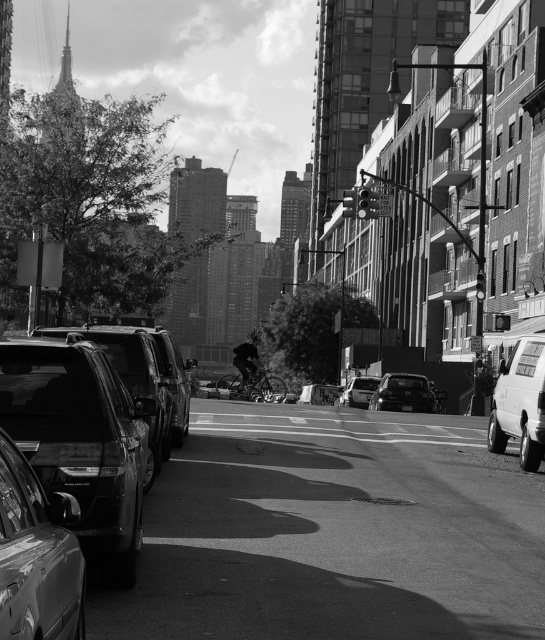
In the scene shown: How far apart are shiny black suv at left and shiny black sedan at center?

A distance of 85.89 feet exists between shiny black suv at left and shiny black sedan at center.

The height and width of the screenshot is (640, 545). What are the coordinates of `shiny black suv at left` in the screenshot? It's located at (83, 440).

Is shiny black suv at left bigger than white matte van at right?

Yes.

Does shiny black suv at left appear on the right side of white matte van at right?

Incorrect, shiny black suv at left is not on the right side of white matte van at right.

Locate an element on the screen. The image size is (545, 640). shiny black suv at left is located at coordinates (83, 440).

The image size is (545, 640). Identify the location of shiny black suv at left. (83, 440).

Is shiny metallic car at lower left bigger than white matte van at right?

Indeed, shiny metallic car at lower left has a larger size compared to white matte van at right.

Is shiny metallic car at lower left thinner than white matte van at right?

Yes, shiny metallic car at lower left is thinner than white matte van at right.

Does point (23, 593) come farther from viewer compared to point (523, 426)?

That is False.

Find the location of a particular element. This screenshot has width=545, height=640. shiny metallic car at lower left is located at coordinates (37, 556).